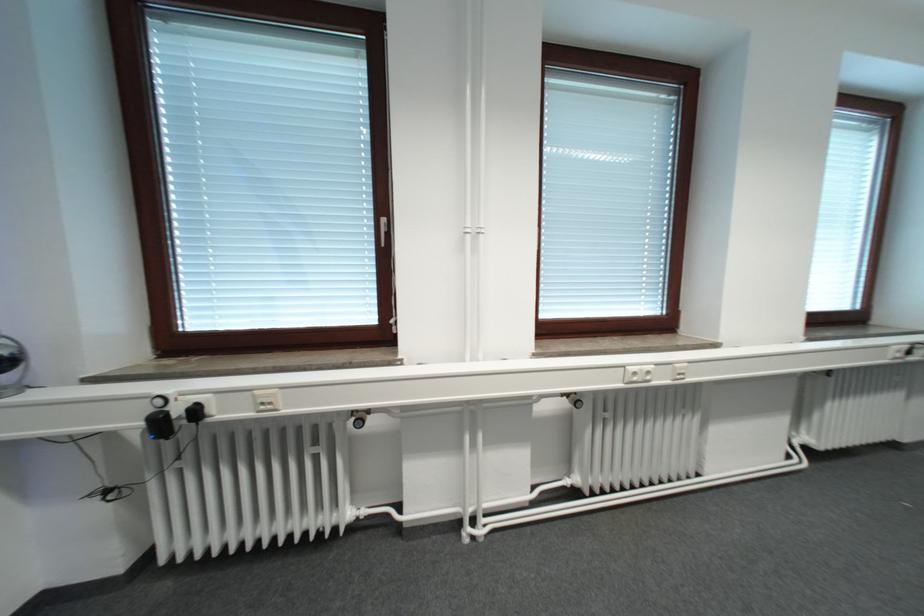
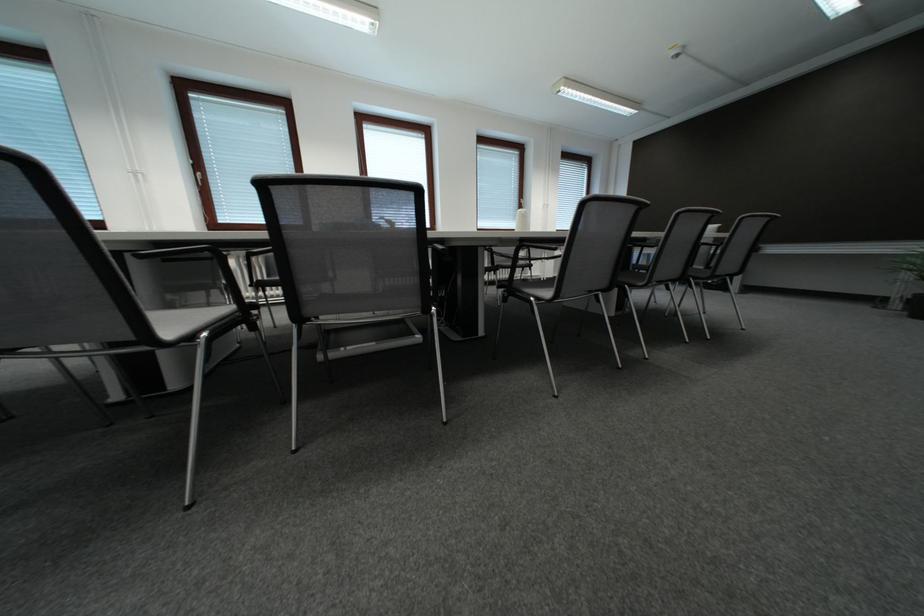
The images are taken continuously from a first-person perspective. In which direction are you moving?

The cameraman moved toward right, backward.